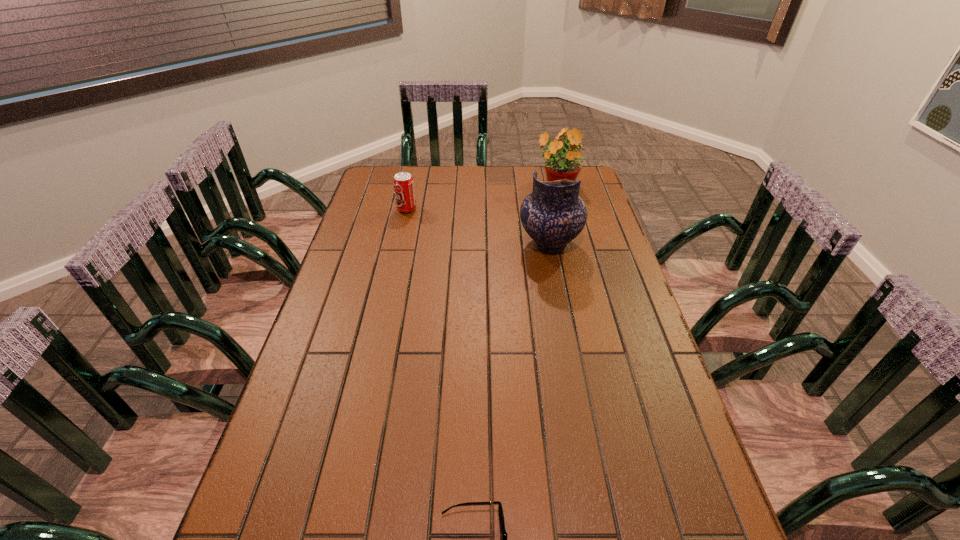
Where is `flowerpot at the right edge`? This screenshot has height=540, width=960. flowerpot at the right edge is located at coordinates 559,165.

The image size is (960, 540). I want to click on object that is positioned at the far right corner, so click(x=559, y=165).

What are the coordinates of `vacant region at the far edge of the desktop` in the screenshot? It's located at (454, 177).

The width and height of the screenshot is (960, 540). Identify the location of vacant position at the left edge of the desktop. (353, 238).

Locate an element on the screen. vacant space at the right edge is located at coordinates (603, 319).

Identify the location of free spot between the farthest object and the soda. Image resolution: width=960 pixels, height=540 pixels. (482, 198).

The image size is (960, 540). In order to click on empty space that is in between the second shortest object and the farthest object in this screenshot , I will do `click(482, 198)`.

The image size is (960, 540). In order to click on free point between the farthest object and the leftmost object in this screenshot , I will do `click(482, 198)`.

You are a GUI agent. You are given a task and a screenshot of the screen. Output one action in this format:
    pyautogui.click(x=<x>, y=<y>)
    Task: Click on the vacant space that is in between the flowerpot and the leftmost object
    This screenshot has width=960, height=540.
    Given the screenshot: What is the action you would take?
    pyautogui.click(x=482, y=198)

This screenshot has height=540, width=960. I want to click on free space that is in between the second nearest object and the second shortest object, so click(478, 227).